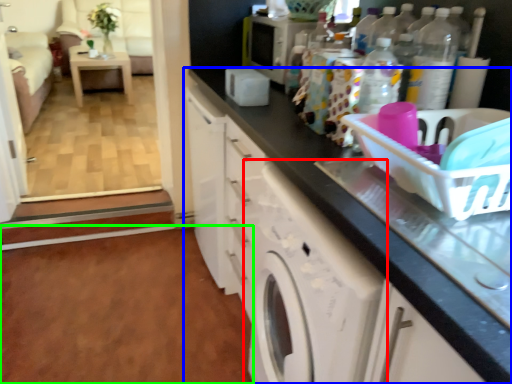
Question: Considering the real-world distances, which object is closest to washing machine (highlighted by a red box)? cabinetry (highlighted by a blue box) or plain (highlighted by a green box).

Choices:
 (A) cabinetry
 (B) plain

Answer: (A)